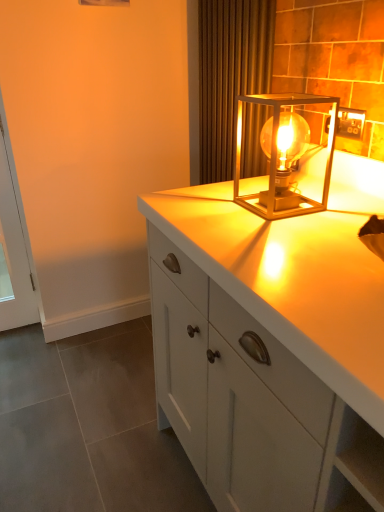
Identify the location of white glass screen door at left. (13, 249).

Find the location of `metallic gold lamp at upper right`. metallic gold lamp at upper right is located at coordinates (283, 159).

The width and height of the screenshot is (384, 512). I want to click on white glossy cabinet at center, so click(x=253, y=405).

Describe the element at coordinates (253, 405) in the screenshot. This screenshot has width=384, height=512. I see `white glossy cabinet at center` at that location.

Find the location of a particular element. The width and height of the screenshot is (384, 512). brown textured curtain at upper center is located at coordinates (230, 74).

Considering the positions of point (222, 20) and point (361, 471), is point (222, 20) closer or farther from the camera than point (361, 471)?

Point (222, 20) is farther from the camera than point (361, 471).

From the image's perspective, is brown textured curtain at upper center below white glossy cabinet at center?

No.

Can white glossy cabinet at center be found inside brown textured curtain at upper center?

No, white glossy cabinet at center is not surrounded by brown textured curtain at upper center.

Can you see brown textured curtain at upper center touching white glossy cabinet at center?

There is a gap between brown textured curtain at upper center and white glossy cabinet at center.

Can you confirm if metallic gold outlet at upper right is taller than white glass screen door at left?

No.

Is metallic gold outlet at upper right far away from white glass screen door at left?

metallic gold outlet at upper right is positioned a significant distance from white glass screen door at left.

Is metallic gold outlet at upper right in front of or behind white glass screen door at left in the image?

metallic gold outlet at upper right is positioned closer to the viewer than white glass screen door at left.

Can you confirm if metallic gold outlet at upper right is thinner than brown textured curtain at upper center?

Correct, the width of metallic gold outlet at upper right is less than that of brown textured curtain at upper center.

Is metallic gold outlet at upper right next to brown textured curtain at upper center?

metallic gold outlet at upper right and brown textured curtain at upper center are not in contact.

How different are the orientations of metallic gold outlet at upper right and brown textured curtain at upper center in degrees?

metallic gold outlet at upper right and brown textured curtain at upper center are facing 0.00998 degrees away from each other.

From the image's perspective, which one is positioned lower, white glossy cabinet at center or metallic gold lamp at upper right?

white glossy cabinet at center is shown below in the image.

From a real-world perspective, which object rests below the other?

From a 3D spatial view, white glossy cabinet at center is below.

Could you tell me if white glossy cabinet at center is facing metallic gold lamp at upper right?

No, white glossy cabinet at center is not facing towards metallic gold lamp at upper right.

From a real-world perspective, is brown textured curtain at upper center over metallic gold lamp at upper right?

Yes, from a real-world perspective, brown textured curtain at upper center is on top of metallic gold lamp at upper right.

What are the coordinates of `curtain behind the metallic gold lamp at upper right` in the screenshot? It's located at (230, 74).

Which of these two, brown textured curtain at upper center or metallic gold lamp at upper right, stands taller?

brown textured curtain at upper center.

Considering the positions of objects brown textured curtain at upper center and metallic gold lamp at upper right in the image provided, who is in front, brown textured curtain at upper center or metallic gold lamp at upper right?

metallic gold lamp at upper right.

Does point (236, 166) lie behind point (301, 466)?

Yes, point (236, 166) is farther from viewer.

Is metallic gold lamp at upper right taller or shorter than white glossy cabinet at center?

In the image, metallic gold lamp at upper right appears to be shorter than white glossy cabinet at center.

Does metallic gold lamp at upper right come behind white glossy cabinet at center?

Yes, the depth of metallic gold lamp at upper right is greater than that of white glossy cabinet at center.

Considering the relative positions of metallic gold lamp at upper right and white glass screen door at left in the image provided, is metallic gold lamp at upper right to the left or to the right of white glass screen door at left?

Clearly, metallic gold lamp at upper right is on the right of white glass screen door at left in the image.

Does metallic gold lamp at upper right have a greater width compared to white glass screen door at left?

Correct, the width of metallic gold lamp at upper right exceeds that of white glass screen door at left.

Does metallic gold lamp at upper right have a larger size compared to white glass screen door at left?

Correct, metallic gold lamp at upper right is larger in size than white glass screen door at left.

I want to click on curtain above the white glossy cabinet at center (from a real-world perspective), so click(230, 74).

At what (x,y) coordinates should I click in order to perform the action: click on electric outlet in front of the white glass screen door at left. Please return your answer as a coordinate pair (x, y). This screenshot has height=512, width=384. Looking at the image, I should click on (350, 123).

Which object lies further to the anchor point white glossy cabinet at center, metallic gold lamp at upper right or brown textured curtain at upper center?

brown textured curtain at upper center.

Based on the photo, based on their spatial positions, is metallic gold lamp at upper right or brown textured curtain at upper center further from white glass screen door at left?

metallic gold lamp at upper right lies further to white glass screen door at left than the other object.

Estimate the real-world distances between objects in this image. Which object is further from metallic gold lamp at upper right, white glossy cabinet at center or brown textured curtain at upper center?

The object further to metallic gold lamp at upper right is white glossy cabinet at center.

Which object lies nearer to the anchor point white glass screen door at left, metallic gold outlet at upper right or brown textured curtain at upper center?

brown textured curtain at upper center is closer to white glass screen door at left.

From the image, which object appears to be nearer to white glossy cabinet at center, white glass screen door at left or metallic gold lamp at upper right?

metallic gold lamp at upper right.

When comparing their distances from brown textured curtain at upper center, does white glossy cabinet at center or white glass screen door at left seem closer?

white glossy cabinet at center is closer to brown textured curtain at upper center.

Consider the image. Estimate the real-world distances between objects in this image. Which object is further from metallic gold lamp at upper right, white glass screen door at left or brown textured curtain at upper center?

white glass screen door at left.

From the image, which object appears to be nearer to brown textured curtain at upper center, white glass screen door at left or metallic gold lamp at upper right?

metallic gold lamp at upper right is closer to brown textured curtain at upper center.

Where is `curtain situated between white glass screen door at left and metallic gold outlet at upper right from left to right`? The image size is (384, 512). curtain situated between white glass screen door at left and metallic gold outlet at upper right from left to right is located at coordinates (230, 74).

At what (x,y) coordinates should I click in order to perform the action: click on lamp between brown textured curtain at upper center and white glossy cabinet at center from top to bottom. Please return your answer as a coordinate pair (x, y). The image size is (384, 512). Looking at the image, I should click on (283, 159).

The image size is (384, 512). In order to click on curtain located between white glass screen door at left and white glossy cabinet at center in the left-right direction in this screenshot , I will do `click(230, 74)`.

Identify the location of curtain between white glass screen door at left and metallic gold lamp at upper right from left to right. (230, 74).